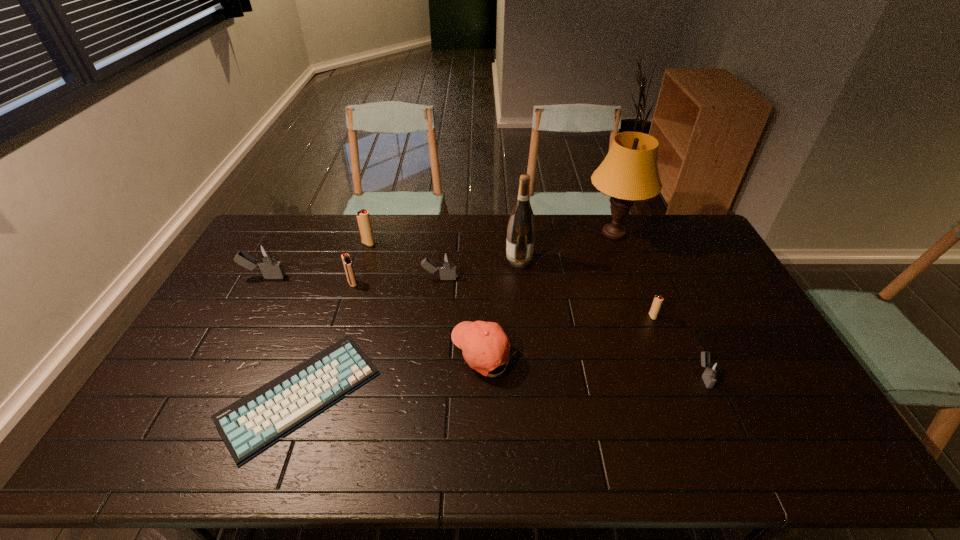
Where is `lampshade`? The width and height of the screenshot is (960, 540). lampshade is located at coordinates (629, 172).

You are a GUI agent. You are given a task and a screenshot of the screen. Output one action in this format:
    pyautogui.click(x=<x>, y=<y>)
    Task: Click on the wine bottle
    
    Given the screenshot: What is the action you would take?
    pyautogui.click(x=521, y=229)

The image size is (960, 540). Identify the location of the farthest igniter. (362, 216).

In order to click on the farthest red igniter in this screenshot , I will do `click(362, 216)`.

At what (x,y) coordinates should I click in order to perform the action: click on the leftmost igniter. Please return your answer as a coordinate pair (x, y). The height and width of the screenshot is (540, 960). Looking at the image, I should click on (266, 258).

At what (x,y) coordinates should I click in order to perform the action: click on the biggest gray igniter. Please return your answer as a coordinate pair (x, y). Looking at the image, I should click on (266, 258).

Find the location of a particular element. the second biggest gray igniter is located at coordinates (448, 271).

Where is `the third igniter from right to left`? The height and width of the screenshot is (540, 960). the third igniter from right to left is located at coordinates (448, 271).

Where is `the second smallest red igniter`? Image resolution: width=960 pixels, height=540 pixels. the second smallest red igniter is located at coordinates (348, 266).

Find the location of a particular element. The width and height of the screenshot is (960, 540). baseball cap is located at coordinates coord(485,346).